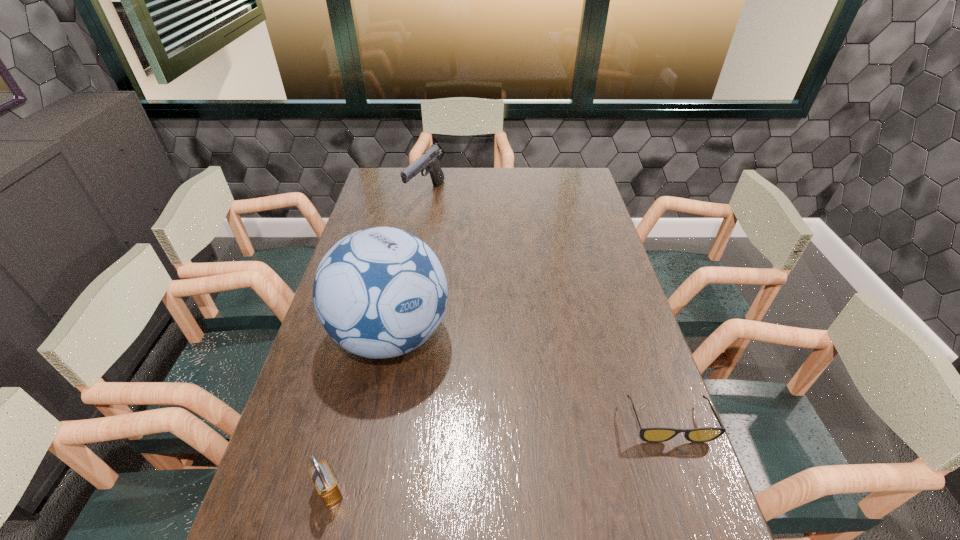
This screenshot has width=960, height=540. Identify the location of vacant area that lies between the tallest object and the padlock. (360, 413).

The height and width of the screenshot is (540, 960). In order to click on vacant point located between the sunglasses and the second shortest object in this screenshot , I will do `click(499, 456)`.

Where is `free space between the second farthest object and the padlock`? Image resolution: width=960 pixels, height=540 pixels. free space between the second farthest object and the padlock is located at coordinates (360, 413).

This screenshot has height=540, width=960. I want to click on blank region between the nearest object and the second nearest object, so click(x=499, y=456).

This screenshot has height=540, width=960. In order to click on the closest object to the rightmost object in this screenshot , I will do `click(381, 292)`.

The image size is (960, 540). I want to click on object identified as the third closest to the shortest object, so click(430, 160).